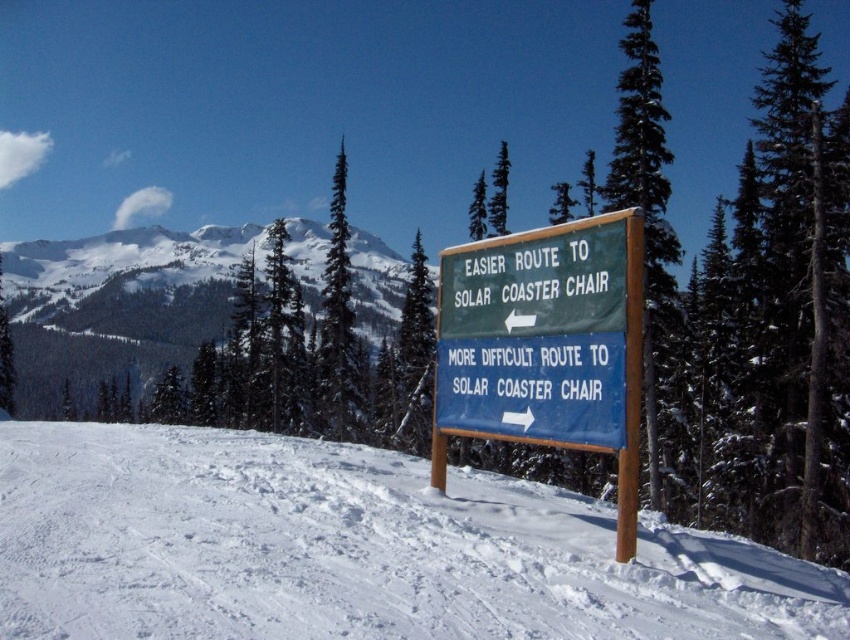
You are standing at the base of the mountain looking at the green wooden sign at center and the white snow at center. According to the signs, which direction should you go to take the easier route to the Solar Coaster Chair?

The green wooden sign at center points left, so you should go left to take the easier route to the Solar Coaster Chair.

You are standing at the wooden signpost with two directional signs. The top green sign points left to the EASIER ROUTE, and the bottom blue sign points right to the MORE DIFFICULT ROUTE. If you want to take the easier path to the Solar Coaster Chair, which direction should you go relative to the white snow at center?

The white snow at center is located at point (353, 548). Since the easier route is pointed to the left by the green sign, you should go left relative to the white snow at center.

You are standing at the wooden signpost with two directional signs. You want to reach the point at coordinates point (306,460) which is 16.30 meters away from you. If you decide to take the EASIER ROUTE TO SOLAR COASTER CHAIR as indicated by the green sign pointing left, will you be moving towards or away from the point?

The point at coordinates point (306,460) is 16.30 meters away from the camera. Since the green sign points left towards the EASIER ROUTE, you would be moving towards the point if the direction of the sign aligns with the point. However, without knowing the exact direction of the point relative to the signpost, it cannot be determined definitively. The answer is inconclusive based on the given information.